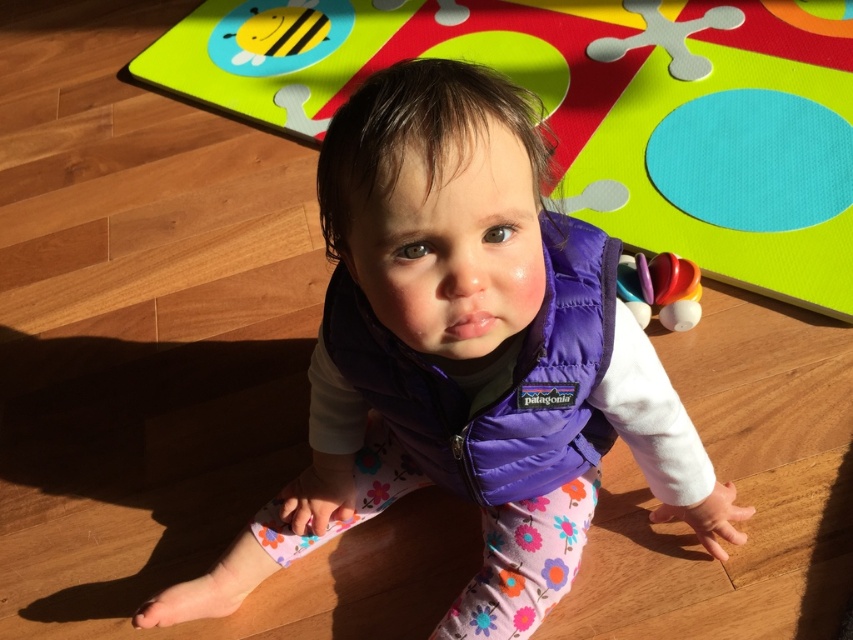
Which is more to the right, purple down vest at center or smooth plastic toy at right?

smooth plastic toy at right

Between point (653, 355) and point (643, 275), which one is positioned behind?

The point (643, 275) is behind.

Identify the location of purple down vest at center. (465, 356).

Is point (456, 417) closer to viewer compared to point (729, 128)?

Yes, it is.

Can you confirm if purple down vest at center is thinner than multicolored foam mat at upper center?

Indeed, purple down vest at center has a lesser width compared to multicolored foam mat at upper center.

The width and height of the screenshot is (853, 640). What are the coordinates of `purple down vest at center` in the screenshot? It's located at (465, 356).

Locate an element on the screen. Image resolution: width=853 pixels, height=640 pixels. purple down vest at center is located at coordinates (465, 356).

Between multicolored foam mat at upper center and smooth plastic toy at right, which one has more height?

With more height is multicolored foam mat at upper center.

Find the location of `multicolored foam mat at upper center`. multicolored foam mat at upper center is located at coordinates (596, 108).